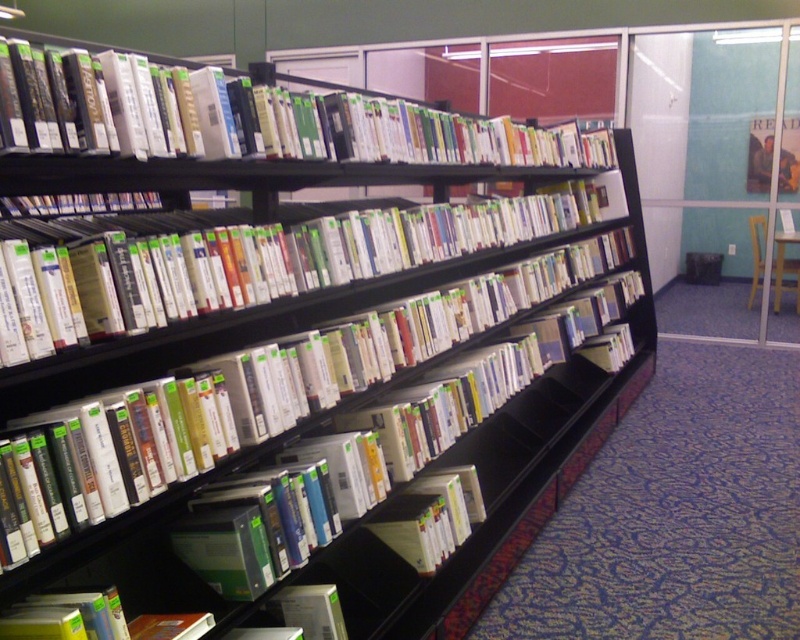
Question: Is hardcover books at upper center thinner than hardcover books at center?

Choices:
 (A) yes
 (B) no

Answer: (B)

Question: Which point is closer to the camera?

Choices:
 (A) hardcover books at upper center
 (B) hardcover books at center

Answer: (B)

Question: Can you confirm if hardcover books at upper center is positioned to the left of hardcover books at center?

Choices:
 (A) yes
 (B) no

Answer: (B)

Question: Which object appears farthest from the camera in this image?

Choices:
 (A) hardcover books at upper center
 (B) hardcover books at center

Answer: (A)

Question: Is hardcover books at upper center wider than hardcover books at center?

Choices:
 (A) no
 (B) yes

Answer: (B)